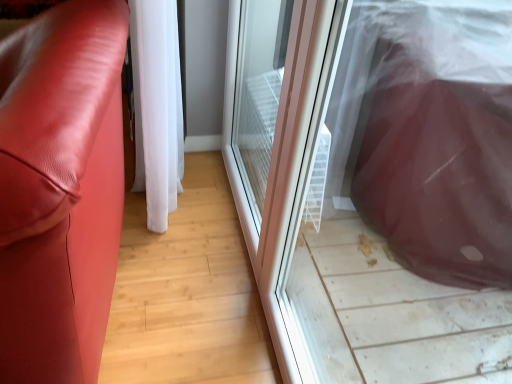
Question: From the image's perspective, is matte leather couch at left located above or below transparent plastic screen door at center, arranged as the 2th screen door when viewed from the front?

Choices:
 (A) below
 (B) above

Answer: (A)

Question: In terms of height, does matte leather couch at left look taller or shorter compared to transparent plastic screen door at center, the 1th screen door when ordered from back to front?

Choices:
 (A) short
 (B) tall

Answer: (A)

Question: Based on their relative distances, which object is farther from the transparent plastic screen door at center, the 1th screen door when ordered from back to front?

Choices:
 (A) transparent plastic screen door at right, which is the second screen door in back-to-front order
 (B) white sheer curtain at center
 (C) matte leather couch at left

Answer: (C)

Question: Which object is the closest to the transparent plastic screen door at right, which is the second screen door in back-to-front order?

Choices:
 (A) white sheer curtain at center
 (B) matte leather couch at left
 (C) transparent plastic screen door at center, arranged as the 2th screen door when viewed from the front

Answer: (C)